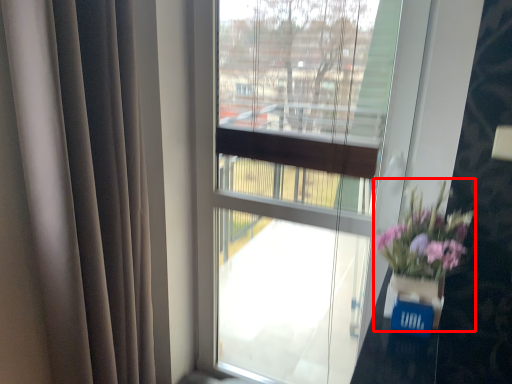
Question: Observing the image, what is the correct spatial positioning of floral arrangement (annotated by the red box) in reference to glass vase?

Choices:
 (A) left
 (B) right

Answer: (B)